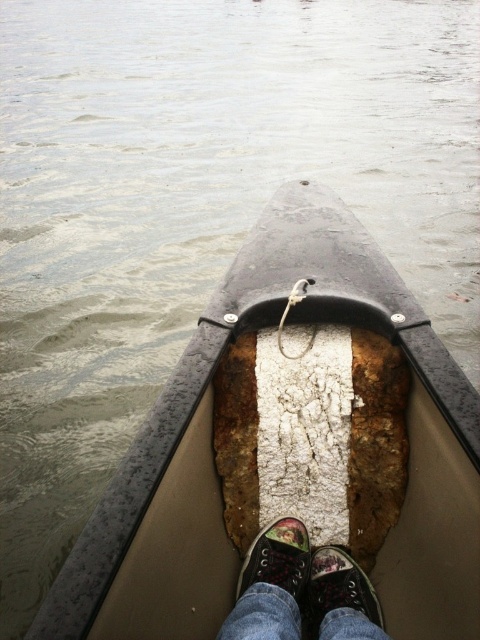
Does black canvas shoe at center appear under multicolored canvas shoe at center?

Indeed, black canvas shoe at center is positioned under multicolored canvas shoe at center.

Is black canvas shoe at center thinner than multicolored canvas shoe at center?

Indeed, black canvas shoe at center has a lesser width compared to multicolored canvas shoe at center.

Does point (338, 605) come closer to viewer compared to point (288, 550)?

Yes, point (338, 605) is in front of point (288, 550).

At what (x,y) coordinates should I click in order to perform the action: click on black canvas shoe at center. Please return your answer as a coordinate pair (x, y). The width and height of the screenshot is (480, 640). Looking at the image, I should click on (336, 588).

Between rusty metal canoe at center and black canvas shoe at center, which one has less height?

black canvas shoe at center

Between point (454, 410) and point (338, 579), which one is positioned in front?

Point (454, 410)

What are the coordinates of `rusty metal canoe at center` in the screenshot? It's located at (216, 474).

Between rusty metal canoe at center and denim jeans at center, which one is positioned lower?

denim jeans at center is lower down.

Between rusty metal canoe at center and denim jeans at center, which one is positioned higher?

rusty metal canoe at center is higher up.

Which is in front, point (126, 525) or point (247, 582)?

Point (126, 525) is in front.

Locate an element on the screen. This screenshot has height=640, width=480. rusty metal canoe at center is located at coordinates (216, 474).